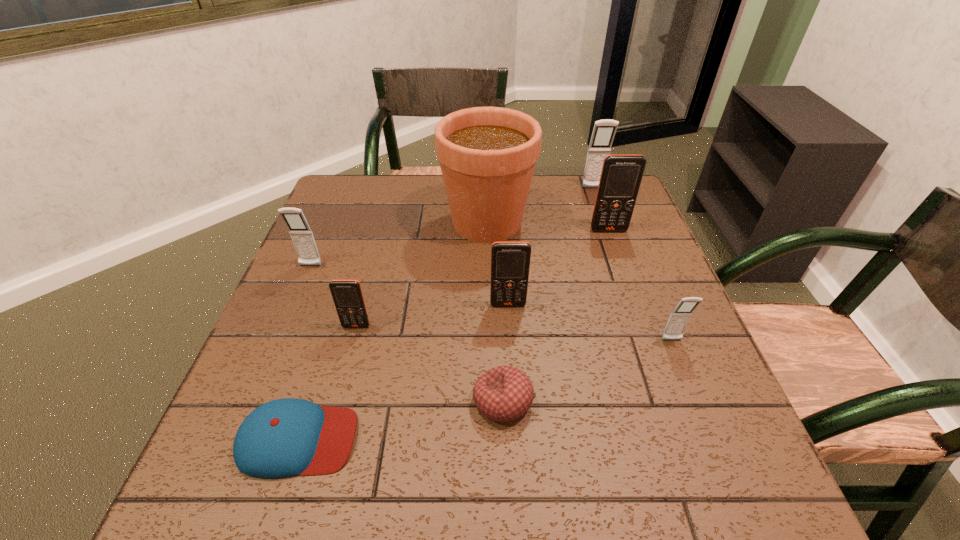
Select which orange cellular telephone is the third closest to the beanbag. Please provide its 2D coordinates. Your answer should be formatted as a tuple, i.e. [(x, y)], where the tuple contains the x and y coordinates of a point satisfying the conditions above.

[(621, 175)]

In order to click on free region that satisfies the following two spatial constraints: 1. on the screen of the fourth farthest cellular telephone; 2. with the bill of the baseball cap facing forward in this screenshot , I will do `click(516, 439)`.

Locate an element on the screen. Image resolution: width=960 pixels, height=540 pixels. vacant space that satisfies the following two spatial constraints: 1. on the screen of the second biggest orange cellular telephone; 2. with the bill of the baseball cap facing forward is located at coordinates (516, 439).

The image size is (960, 540). I want to click on blank space that satisfies the following two spatial constraints: 1. on the screen of the leftmost orange cellular telephone; 2. with the bill of the baseball cap facing forward, so click(326, 439).